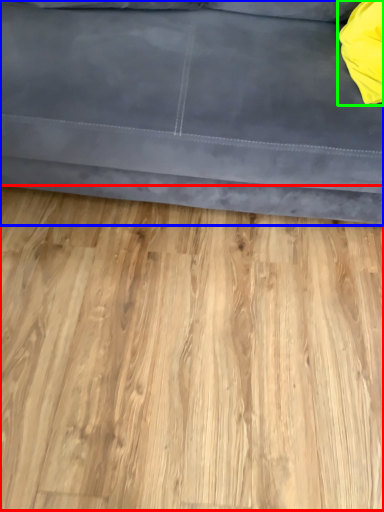
Question: Which object is positioned closest to hardwood (highlighted by a red box)? Select from studio couch (highlighted by a blue box) and pillow (highlighted by a green box).

Choices:
 (A) studio couch
 (B) pillow

Answer: (A)